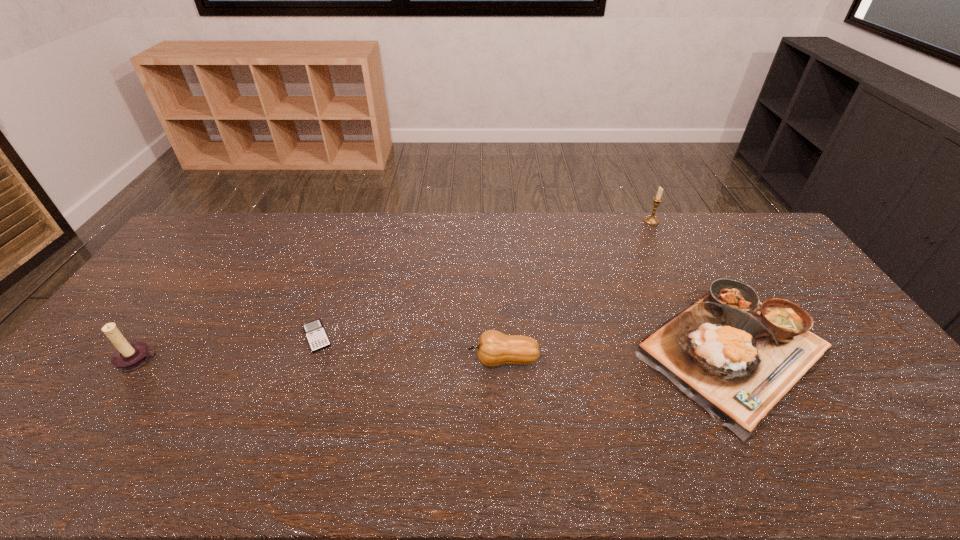
The width and height of the screenshot is (960, 540). I want to click on vacant region located on the stem side of the third object from right to left, so click(x=381, y=360).

Locate an element on the screen. Image resolution: width=960 pixels, height=540 pixels. vacant space situated on the stem side of the third object from right to left is located at coordinates (334, 360).

You are a GUI agent. You are given a task and a screenshot of the screen. Output one action in this format:
    pyautogui.click(x=<x>, y=<y>)
    Task: Click on the vacant space located 0.210m on the stem side of the third object from right to left
    
    Given the screenshot: What is the action you would take?
    pos(393,360)

Identify the location of free space located on the left of the platter. (545, 349).

Find the location of a particular element. The width and height of the screenshot is (960, 540). free space located 0.350m on the left of the shortest object is located at coordinates (178, 336).

The image size is (960, 540). Find the location of `object at the far edge`. object at the far edge is located at coordinates (650, 220).

At what (x,y) coordinates should I click in order to perform the action: click on object that is at the near edge. Please return your answer as a coordinate pair (x, y). The width and height of the screenshot is (960, 540). Looking at the image, I should click on (736, 357).

Where is `object located in the left edge section of the desktop`? The height and width of the screenshot is (540, 960). object located in the left edge section of the desktop is located at coordinates (128, 356).

I want to click on object located in the right edge section of the desktop, so click(736, 357).

Where is `object present at the near right corner`? The height and width of the screenshot is (540, 960). object present at the near right corner is located at coordinates (736, 357).